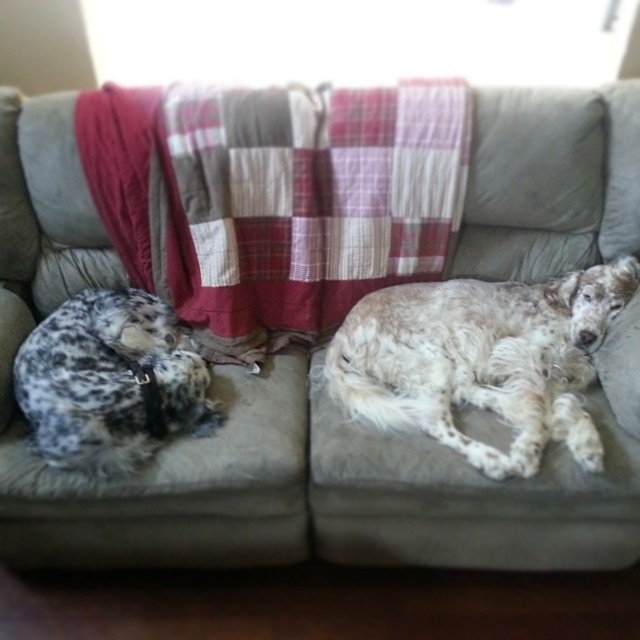
Where is `plaid fabric blanket at center`? plaid fabric blanket at center is located at coordinates (276, 198).

Does point (456, 104) come farther from viewer compared to point (52, 438)?

Yes, it is.

Which is in front, point (349, 205) or point (208, 376)?

Positioned in front is point (208, 376).

You are a GUI agent. You are given a task and a screenshot of the screen. Output one action in this format:
    pyautogui.click(x=<x>, y=<y>)
    Task: Click on the plaid fabric blanket at center
    This screenshot has height=640, width=640.
    Given the screenshot: What is the action you would take?
    click(276, 198)

Between point (580, 314) and point (68, 317), which one is positioned behind?

The point (580, 314) is behind.

Which is in front, point (433, 381) or point (68, 428)?

Positioned in front is point (68, 428).

Locate an element on the screen. Image resolution: width=640 pixels, height=640 pixels. speckled fur dog at right is located at coordinates (481, 360).

Which of these two, plaid fabric blanket at center or speckled fur dog at right, stands shorter?

With less height is speckled fur dog at right.

Who is positioned more to the right, plaid fabric blanket at center or speckled fur dog at right?

Positioned to the right is speckled fur dog at right.

Find the location of a particular element. The height and width of the screenshot is (640, 640). plaid fabric blanket at center is located at coordinates pyautogui.click(x=276, y=198).